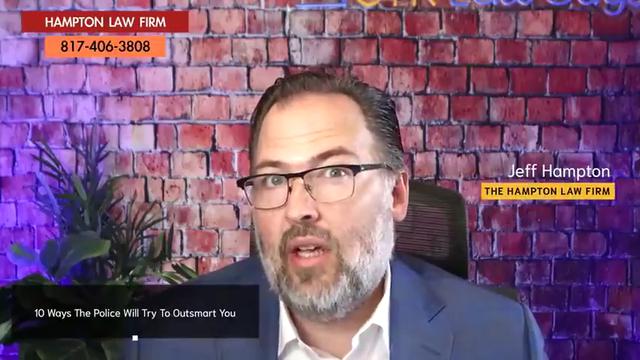
Identify the location of brick background. (451, 80).